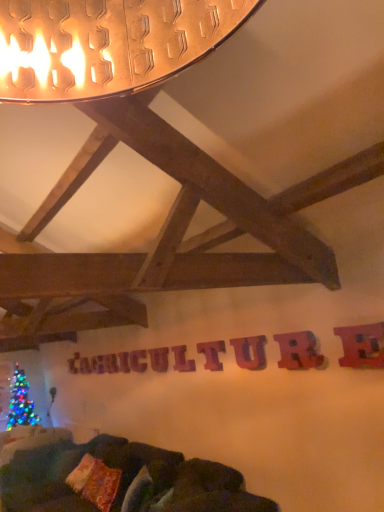
Question: From a real-world perspective, is wooden letter at center, which is counted as the 4th letter, starting from the left, physically located above or below velvet dark green couch at lower center?

Choices:
 (A) above
 (B) below

Answer: (A)

Question: Is point (155, 367) closer or farther from the camera than point (233, 478)?

Choices:
 (A) closer
 (B) farther

Answer: (B)

Question: Which is farther from the wooden letter at center, which is the eighth letter in left-to-right order?

Choices:
 (A) wooden letter at center, which is the 9th letter in front-to-back order
 (B) velvet dark green couch at lower center
 (C) wooden letter at center, positioned as the 4th letter in back-to-front order
 (D) wooden letter at center, the 5th letter in the front-to-back sequence
 (E) wooden letter at center, the second letter positioned from the left

Answer: (A)

Question: Considering the real-world distances, which object is farthest from the metallic red letter at upper right, acting as the ninth letter starting from the left?

Choices:
 (A) wooden letter at center, which ranks as the sixth letter in back-to-front order
 (B) wooden letter at center, placed as the 5th letter when sorted from left to right
 (C) velvety orange pillow at lower center, placed as the first pillow when sorted from right to left
 (D) velvety brown pillow at lower center, positioned as the 1th pillow in back-to-front order
 (E) purple wood letter at center, the 7th letter when ordered from back to front

Answer: (D)